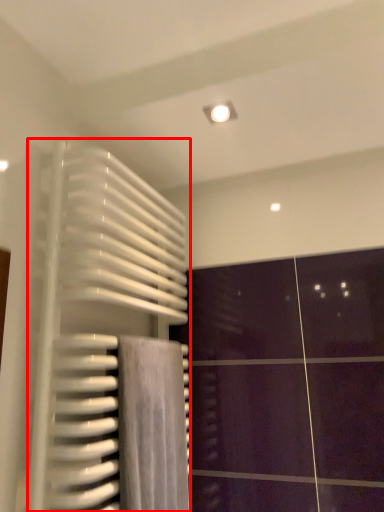
Question: Observing the image, what is the correct spatial positioning of radiator (annotated by the red box) in reference to bath towel?

Choices:
 (A) right
 (B) left

Answer: (B)